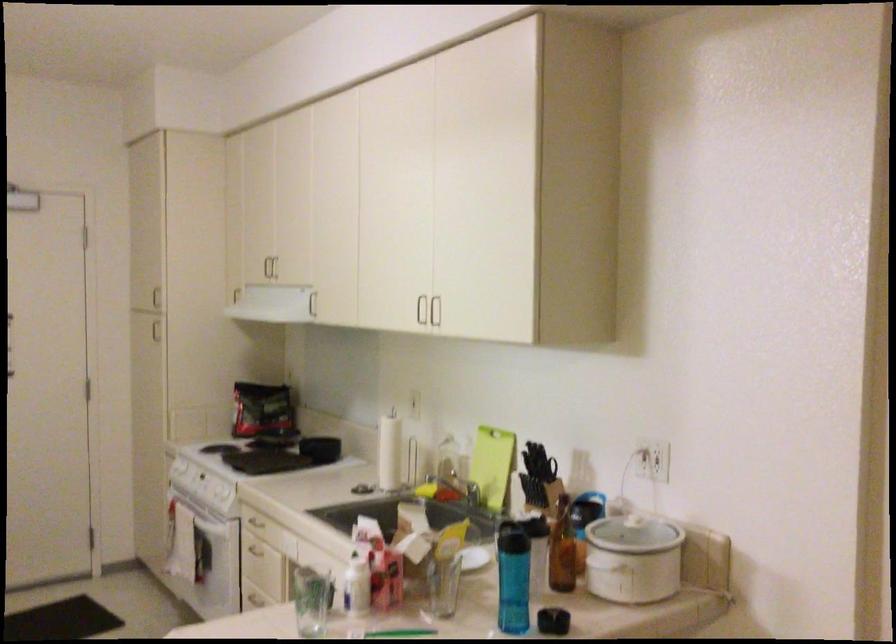
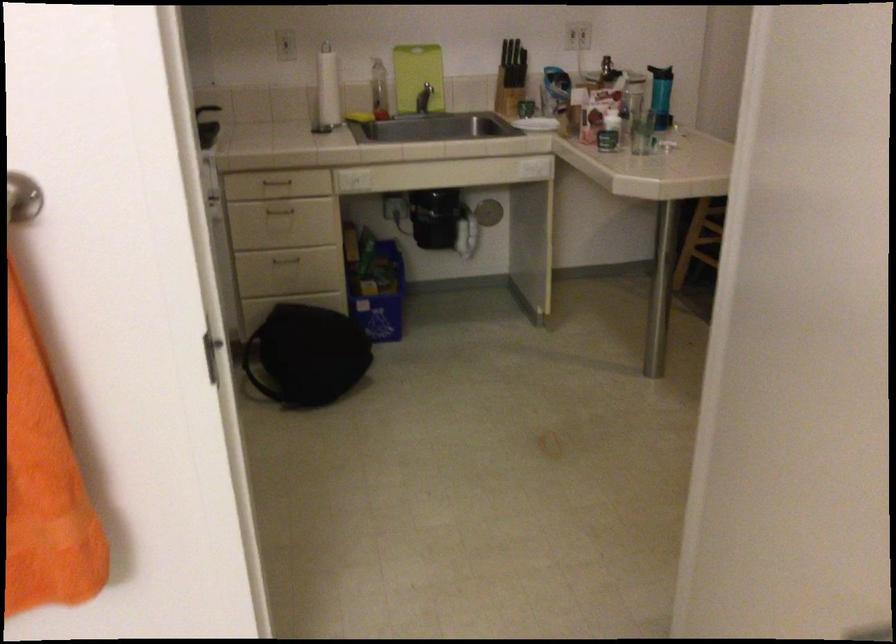
Locate, in the second image, the point that corresponds to (270,523) in the first image.

(277, 183)